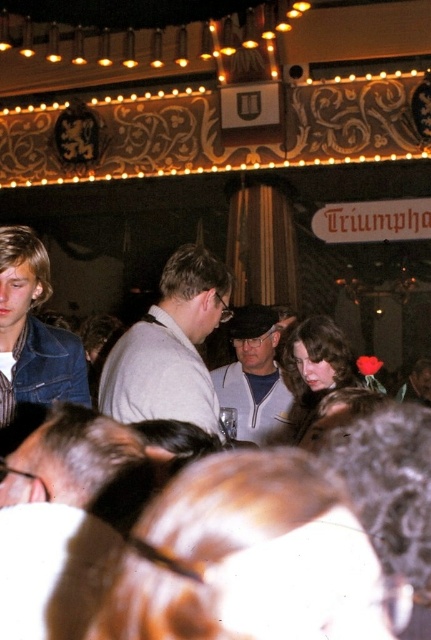
Between point (25, 320) and point (243, 353), which one is positioned behind?

Positioned behind is point (243, 353).

Find the location of a particular element. This screenshot has width=431, height=640. faded denim jacket at lower right is located at coordinates (33, 332).

Locate an element on the screen. Image resolution: width=431 pixels, height=640 pixels. faded denim jacket at lower right is located at coordinates (33, 332).

Measure the distance between gray fabric shirt at center and camera.

gray fabric shirt at center and camera are 96.29 feet apart from each other.

Is point (212, 284) more distant than point (278, 406)?

No, (212, 284) is in front of (278, 406).

Which is behind, point (161, 348) or point (265, 380)?

Positioned behind is point (265, 380).

Where is `gray fabric shirt at center`? This screenshot has width=431, height=640. gray fabric shirt at center is located at coordinates (169, 348).

Can you confirm if gray fabric shirt at center is smaller than faded denim jacket at lower right?

No.

Measure the distance from gray fabric shirt at center to faded denim jacket at lower right.

4.46 meters

This screenshot has width=431, height=640. What do you see at coordinates (169, 348) in the screenshot?
I see `gray fabric shirt at center` at bounding box center [169, 348].

Locate an element on the screen. The width and height of the screenshot is (431, 640). gray fabric shirt at center is located at coordinates (169, 348).